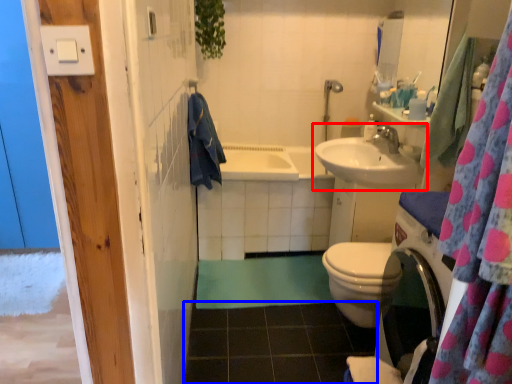
Question: Which point is further to the camera, sink (highlighted by a red box) or tile (highlighted by a blue box)?

Choices:
 (A) sink
 (B) tile

Answer: (A)